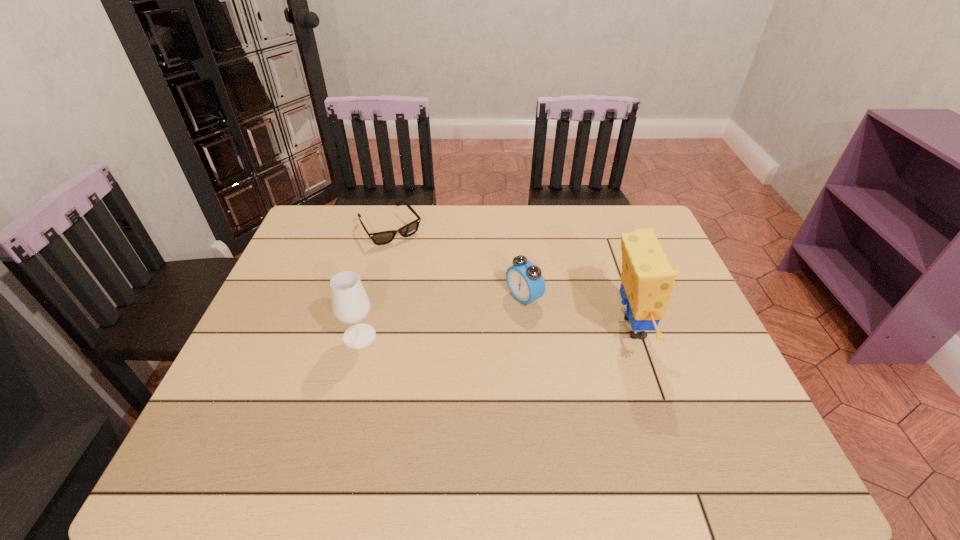
You are a GUI agent. You are given a task and a screenshot of the screen. Output one action in this format:
    pyautogui.click(x=<x>, y=<y>)
    Task: Click on the vacant position located 0.050m on the front-facing side of the farthest object
    This screenshot has width=960, height=540.
    Given the screenshot: What is the action you would take?
    pyautogui.click(x=410, y=254)

Where is `blank space located on the face of the alarm clock`? The image size is (960, 540). blank space located on the face of the alarm clock is located at coordinates (390, 370).

Identify the location of blank area located on the face of the alarm clock. The image size is (960, 540). (475, 324).

At what (x,y) coordinates should I click in order to perform the action: click on vacant space located on the face of the alarm clock. Please return your answer as a coordinate pair (x, y). Looking at the image, I should click on (449, 339).

In order to click on object present at the far edge in this screenshot , I will do `click(379, 238)`.

I want to click on object positioned at the right edge, so click(x=647, y=277).

Identify the location of vacant space at the far edge. The height and width of the screenshot is (540, 960). tap(556, 225).

Where is `free space at the near edge of the desktop`? This screenshot has height=540, width=960. free space at the near edge of the desktop is located at coordinates (540, 407).

Locate an element on the screen. The height and width of the screenshot is (540, 960). free point at the left edge is located at coordinates (280, 358).

Where is `vacant space at the far left corner`? vacant space at the far left corner is located at coordinates (343, 215).